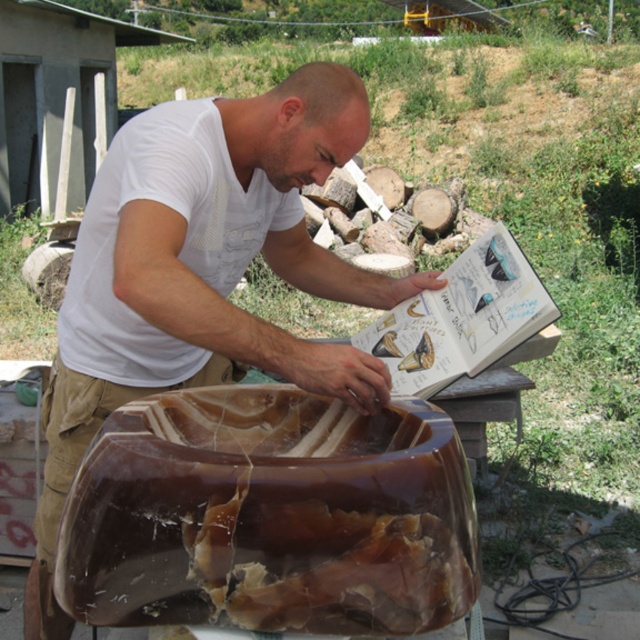
Question: Is white matte shirt at center smaller than brown leather belt at lower center?

Choices:
 (A) yes
 (B) no

Answer: (B)

Question: Which of the following is the closest to the observer?

Choices:
 (A) (161, 344)
 (B) (358, 561)

Answer: (B)

Question: Does white matte shirt at center appear under brown leather belt at lower center?

Choices:
 (A) no
 (B) yes

Answer: (A)

Question: Can you confirm if translucent amber bowl at center is positioned to the right of white matte shirt at center?

Choices:
 (A) no
 (B) yes

Answer: (B)

Question: Estimate the real-world distances between objects in this image. Which object is closer to the brown leather belt at lower center?

Choices:
 (A) white matte shirt at center
 (B) translucent amber bowl at center

Answer: (A)

Question: Which object appears farthest from the camera in this image?

Choices:
 (A) white matte shirt at center
 (B) brown leather belt at lower center
 (C) translucent amber bowl at center

Answer: (B)